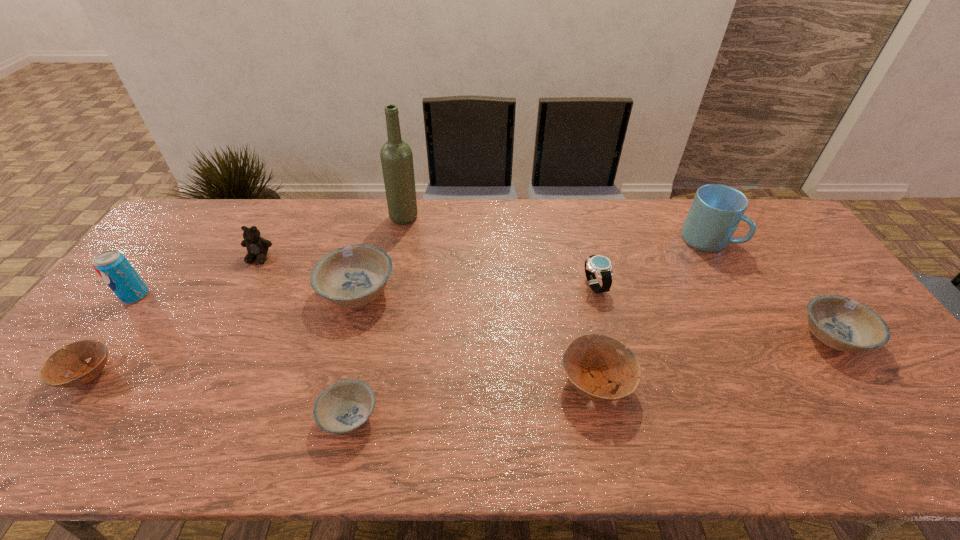
Choose which blue bowl is the nearest neighbor to the biggest blue bowl. Please provide its 2D coordinates. Your answer should be formatted as a tuple, i.e. [(x, y)], where the tuple contains the x and y coordinates of a point satisfying the conditions above.

[(344, 407)]

What are the coordinates of `vacant space that satisfies the following two spatial constraints: 1. on the face of the fourth tallest object; 2. on the right side of the bigger brown bowl` in the screenshot? It's located at (194, 383).

The width and height of the screenshot is (960, 540). I want to click on free location that satisfies the following two spatial constraints: 1. on the back side of the smallest blue bowl; 2. on the left side of the mug, so click(x=389, y=241).

Where is `vacant space that satisfies the following two spatial constraints: 1. on the front side of the biggest blue bowl; 2. on the left side of the right brown bowl`? The width and height of the screenshot is (960, 540). vacant space that satisfies the following two spatial constraints: 1. on the front side of the biggest blue bowl; 2. on the left side of the right brown bowl is located at coordinates (333, 383).

You are a GUI agent. You are given a task and a screenshot of the screen. Output one action in this format:
    pyautogui.click(x=<x>, y=<y>)
    Task: Click on the vacant area in the image that satisfies the following two spatial constraints: 1. on the back side of the biggest blue bowl; 2. on the left side of the ninth object from left to right
    This screenshot has height=540, width=960.
    Given the screenshot: What is the action you would take?
    pyautogui.click(x=372, y=241)